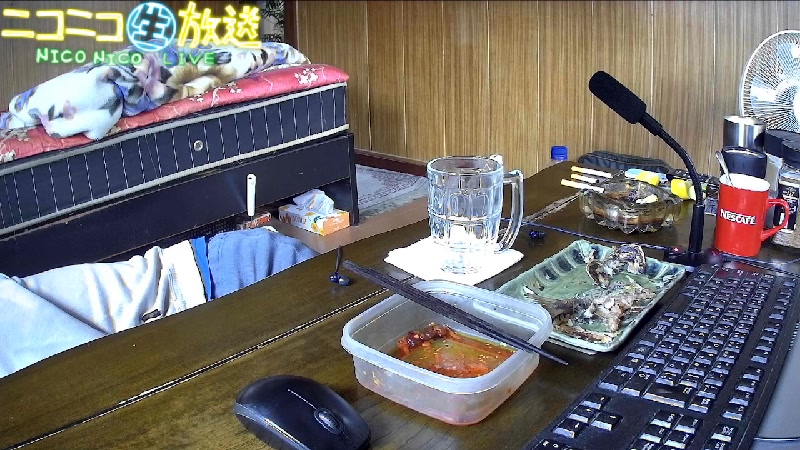
Locate an element on the screen. The image size is (800, 450). headphone is located at coordinates (338, 282), (537, 232).